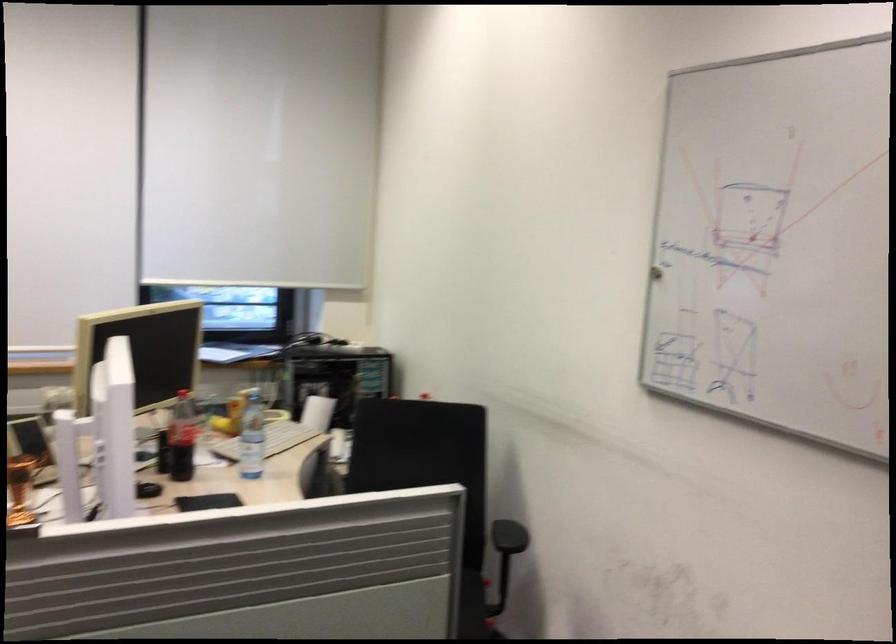
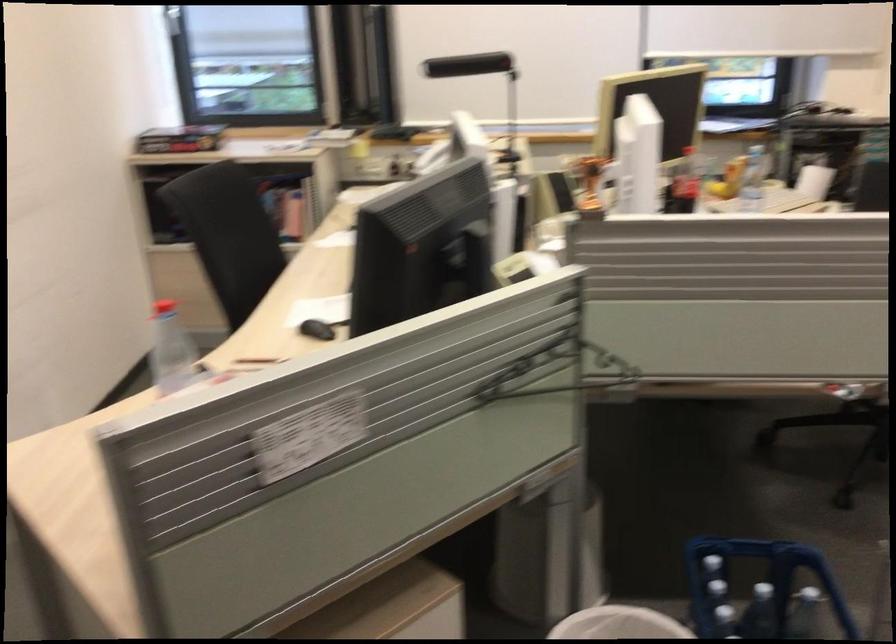
Question: The first image is from the beginning of the video and the second image is from the end. How did the camera likely rotate when shooting the video?

Choices:
 (A) Left
 (B) Right
 (C) Up
 (D) Down

Answer: (A)